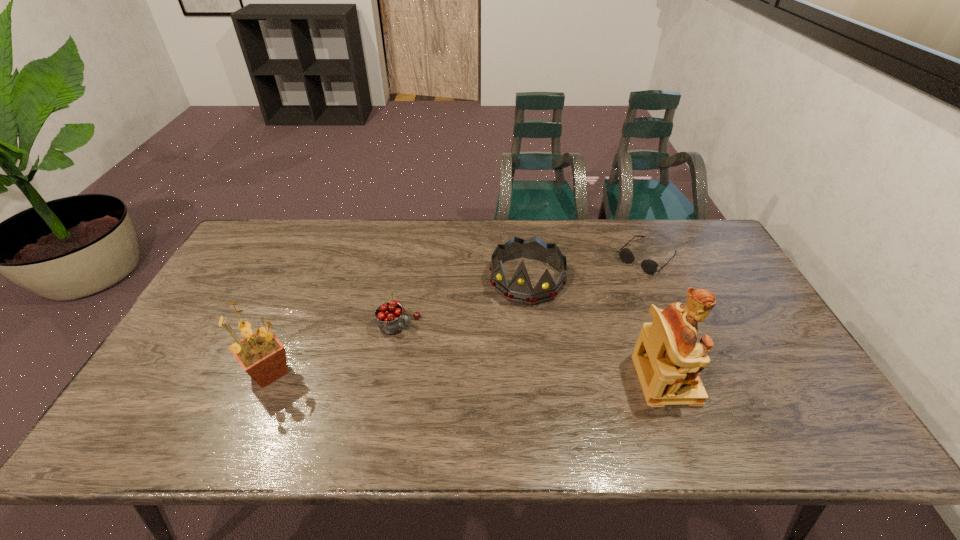
You are a GUI agent. You are given a task and a screenshot of the screen. Output one action in this format:
    pyautogui.click(x=<x>, y=<y>)
    Task: Click on the free space in the image that satisfies the following two spatial constraints: 1. on the back side of the sunglasses; 2. on the left side of the tiara
    Image resolution: width=960 pixels, height=540 pixels.
    Given the screenshot: What is the action you would take?
    pyautogui.click(x=524, y=258)